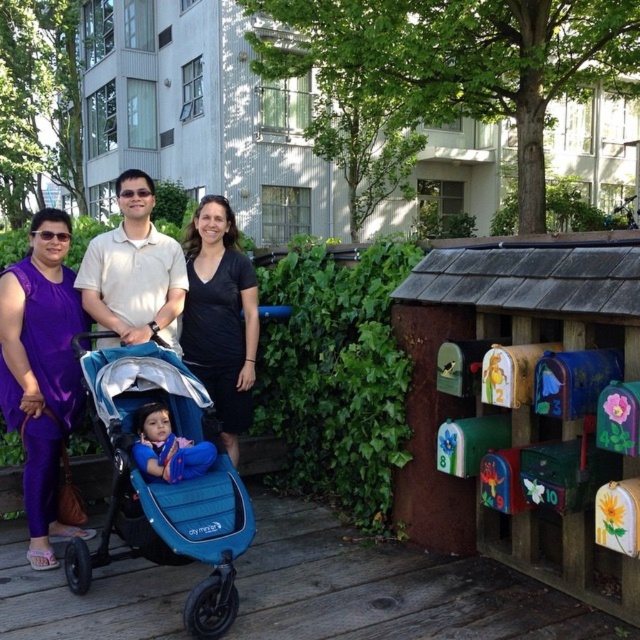
Question: Is black matte dress at center bigger than matte white polo shirt at center?

Choices:
 (A) yes
 (B) no

Answer: (A)

Question: Which of the following is the farthest from the observer?

Choices:
 (A) (122, 436)
 (B) (244, 385)

Answer: (B)

Question: Is matte blue stroller at center bigger than matte white polo shirt at center?

Choices:
 (A) no
 (B) yes

Answer: (B)

Question: Which is farther from the matte blue stroller at center?

Choices:
 (A) blue fabric baby at center
 (B) matte white polo shirt at center
 (C) blue fabric stroller at center
 (D) purple fabric dress at left

Answer: (C)

Question: Is blue fabric stroller at center positioned in front of matte white polo shirt at center?

Choices:
 (A) no
 (B) yes

Answer: (B)

Question: Which object is the closest to the blue fabric stroller at center?

Choices:
 (A) purple fabric dress at left
 (B) matte white polo shirt at center
 (C) blue fabric baby at center
 (D) matte blue stroller at center

Answer: (C)